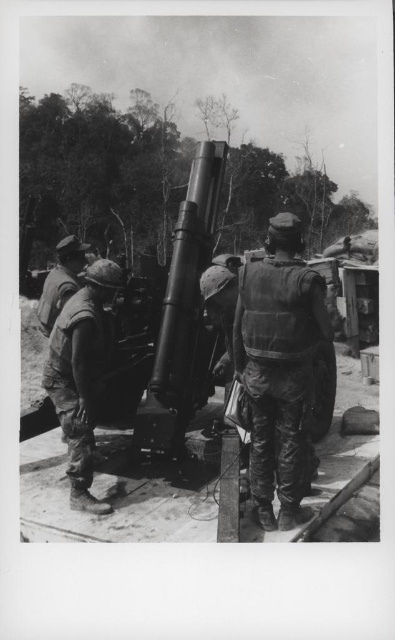
Question: Which of these objects is positioned farthest from the camouflage fabric uniform at center?

Choices:
 (A) camouflage fabric helmet at center
 (B) camouflage fabric vest at center

Answer: (B)

Question: Which point is closer to the camera?

Choices:
 (A) (82, 500)
 (B) (291, 460)

Answer: (B)

Question: Does camouflage fabric vest at center appear on the left side of camouflage fabric helmet at center?

Choices:
 (A) yes
 (B) no

Answer: (B)

Question: Is camouflage fabric uniform at center wider than camouflage fabric helmet at center?

Choices:
 (A) no
 (B) yes

Answer: (A)

Question: Is camouflage fabric vest at center smaller than camouflage fabric uniform at center?

Choices:
 (A) yes
 (B) no

Answer: (A)

Question: Which point is farther to the camera?

Choices:
 (A) camouflage fabric uniform at center
 (B) camouflage fabric helmet at center

Answer: (B)